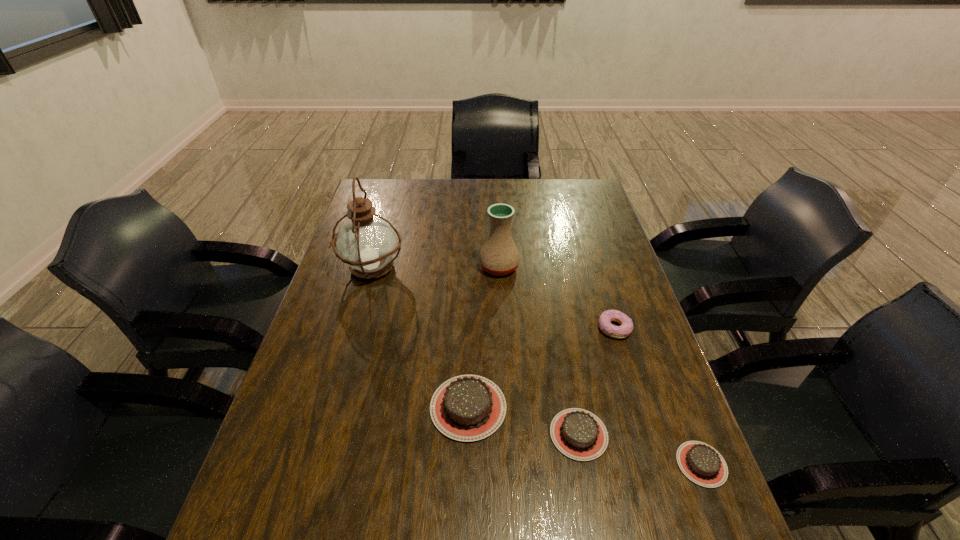
You are a GUI agent. You are given a task and a screenshot of the screen. Output one action in this format:
    pyautogui.click(x=<x>, y=<y>)
    Task: Click on the vacant space located 0.310m on the back of the leftmost chocolate cake
    Image resolution: width=960 pixels, height=540 pixels.
    Given the screenshot: What is the action you would take?
    pyautogui.click(x=471, y=291)

Find the location of a particular element. The image size is (960, 540). vacant region located 0.170m on the left of the second shortest chocolate cake is located at coordinates (472, 434).

The height and width of the screenshot is (540, 960). What are the coordinates of `vacant space located on the left of the shortest chocolate cake` in the screenshot? It's located at (638, 464).

This screenshot has height=540, width=960. I want to click on vacant area situated on the front of the leftmost object, so click(339, 380).

Image resolution: width=960 pixels, height=540 pixels. I want to click on vacant space located 0.300m on the right of the fifth shortest object, so click(614, 267).

Find the location of a particular element. free spot located on the left of the third farthest object is located at coordinates (510, 328).

The image size is (960, 540). In order to click on object located at the near edge in this screenshot , I will do `click(702, 464)`.

Find the location of a particular element. The height and width of the screenshot is (540, 960). object located at the left edge is located at coordinates (367, 243).

You are a GUI agent. You are given a task and a screenshot of the screen. Output one action in this format:
    pyautogui.click(x=<x>, y=<y>)
    Task: Click on the chocolate cake present at the right edge
    Image resolution: width=960 pixels, height=540 pixels.
    Given the screenshot: What is the action you would take?
    pyautogui.click(x=702, y=464)

Identify the location of doughnut that is positioned at the right edge. (619, 332).